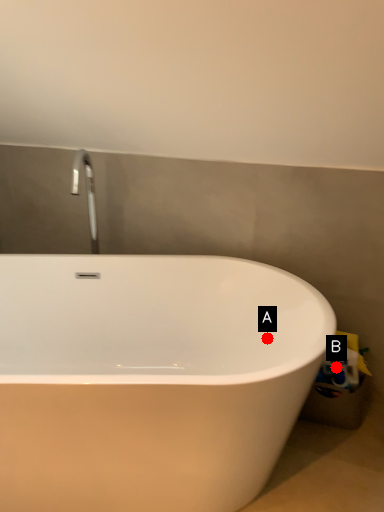
Question: Two points are circled on the image, labeled by A and B beside each circle. Which point is farther to the camera?

Choices:
 (A) A is further
 (B) B is further

Answer: (B)